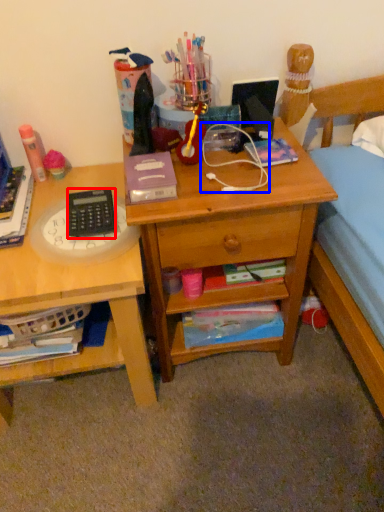
Question: Which point is closer to the camera, remote control (highlighted by a red box) or twin (highlighted by a blue box)?

Choices:
 (A) remote control
 (B) twin

Answer: (B)